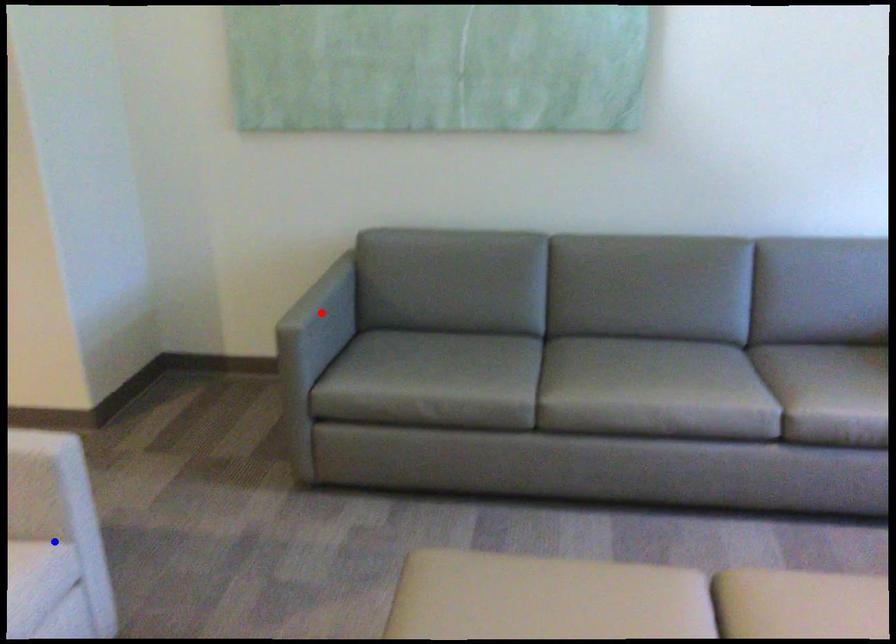
Question: Two points are marked on the image. Which point is closer to the camera?

Choices:
 (A) Blue point is closer.
 (B) Red point is closer.

Answer: (A)